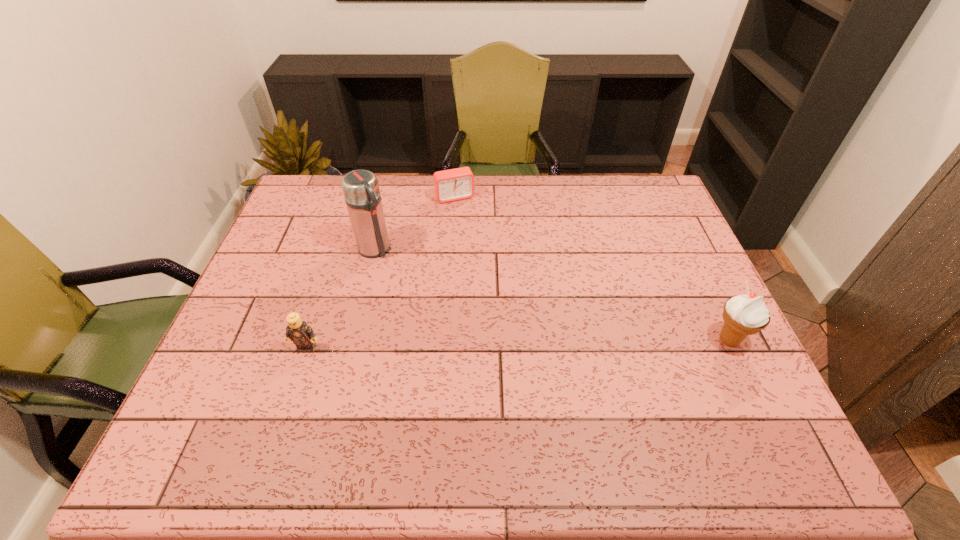
This screenshot has height=540, width=960. Find the location of `Lego`. Lego is located at coordinates (298, 331).

The height and width of the screenshot is (540, 960). Find the location of `the leftmost object`. the leftmost object is located at coordinates (298, 331).

At what (x,y) coordinates should I click in order to perform the action: click on icecream. Please return your answer as a coordinate pair (x, y). The image size is (960, 540). Looking at the image, I should click on (743, 315).

Find the location of a particular element. Image resolution: width=960 pixels, height=540 pixels. the rightmost object is located at coordinates (743, 315).

Image resolution: width=960 pixels, height=540 pixels. Find the location of `thermos bottle`. thermos bottle is located at coordinates (361, 191).

Find the location of a particular element. The height and width of the screenshot is (540, 960). the third object from right to left is located at coordinates (361, 191).

Locate an element on the screen. This screenshot has width=960, height=540. the farthest object is located at coordinates click(x=450, y=185).

Where is `the shortest object`? This screenshot has height=540, width=960. the shortest object is located at coordinates 450,185.

Locate an element on the screen. This screenshot has width=960, height=540. vacant area situated in front of the third tallest object is located at coordinates (295, 386).

Identify the location of vacant space situated 0.290m on the back of the rightmost object. Image resolution: width=960 pixels, height=540 pixels. (685, 248).